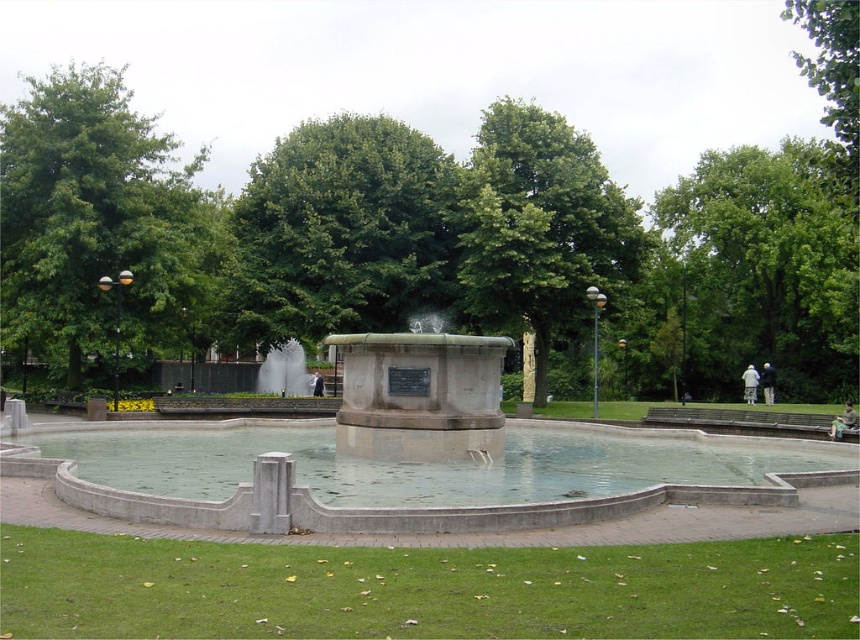
Question: Can you confirm if green leafy tree at upper left is bigger than green leafy tree at upper center?

Choices:
 (A) yes
 (B) no

Answer: (A)

Question: Which is nearer to the green leafy tree at upper right?

Choices:
 (A) green leafy tree at upper center
 (B) green leafy tree at right

Answer: (B)

Question: Is green leafy tree at center wider than green leafy tree at upper right?

Choices:
 (A) no
 (B) yes

Answer: (A)

Question: Based on their relative distances, which object is nearer to the green leafy tree at center?

Choices:
 (A) smooth concrete fountain at center
 (B) green leafy tree at right
 (C) green leafy tree at upper right

Answer: (A)

Question: Which of these objects is positioned farthest from the green leafy tree at right?

Choices:
 (A) green leafy tree at upper left
 (B) green leafy tree at upper right
 (C) green leafy tree at upper center

Answer: (A)

Question: Can you confirm if smooth concrete fountain at center is positioned to the left of green leafy tree at upper left?

Choices:
 (A) yes
 (B) no

Answer: (B)